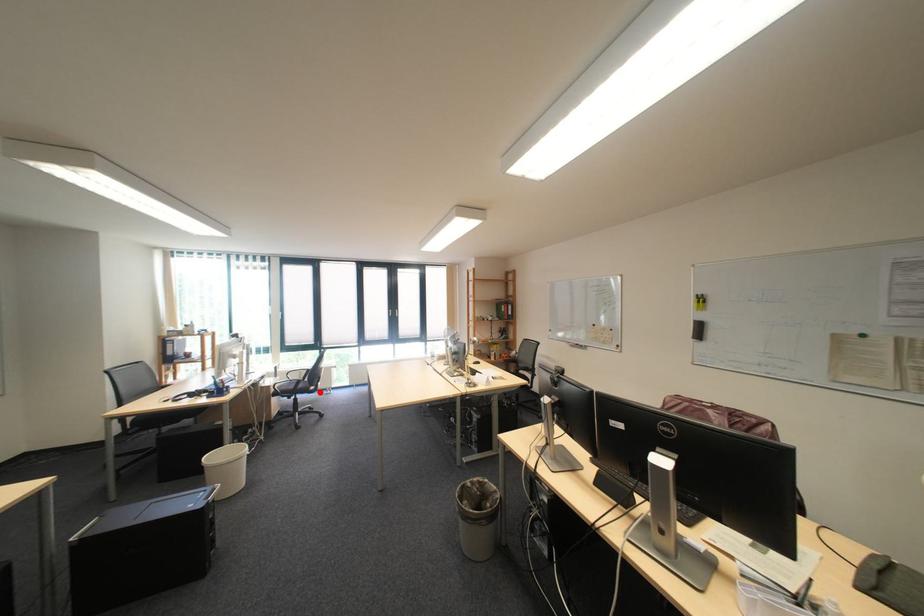
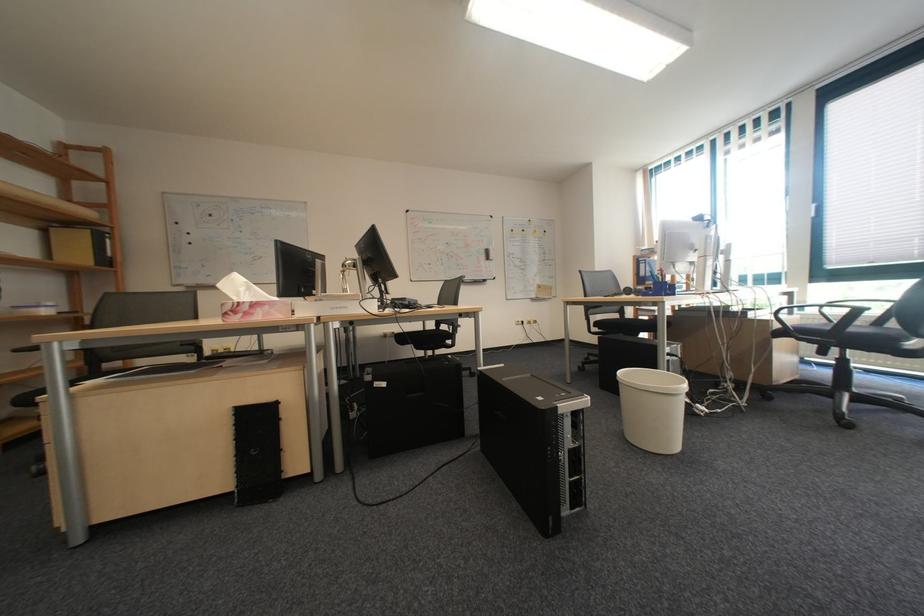
Question: I am providing you with two images of the same scene from different viewpoints. Given a red point in image1, look at the same physical point in image2. Is it:

Choices:
 (A) Closer to the viewpoint
 (B) Farther from the viewpoint

Answer: (A)